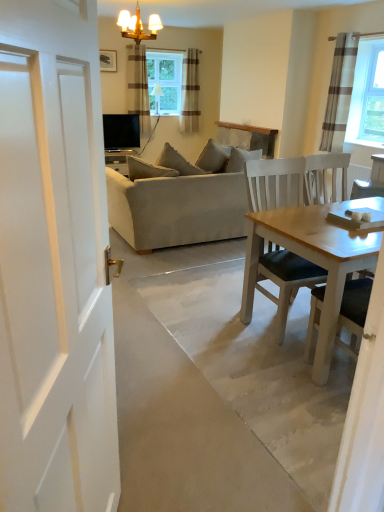
Question: Looking at their shapes, would you say gray striped curtain at upper right, which appears as the 3th curtain when viewed from the left, is wider or thinner than clear glass window at upper center?

Choices:
 (A) thin
 (B) wide

Answer: (B)

Question: Considering the positions of gray striped curtain at upper right, acting as the third curtain starting from the back, and clear glass window at upper center in the image, is gray striped curtain at upper right, acting as the third curtain starting from the back, taller or shorter than clear glass window at upper center?

Choices:
 (A) tall
 (B) short

Answer: (A)

Question: Which object is positioned closest to the beige striped curtain at upper center, arranged as the second curtain when viewed from the left?

Choices:
 (A) gray striped curtain at upper right, which appears as the 3th curtain when viewed from the left
 (B) beige fabric couch at center
 (C) clear glass window at upper center
 (D) wooden table at right
 (E) sheer brown striped curtain at upper center, placed as the second curtain when sorted from back to front

Answer: (C)

Question: Estimate the real-world distances between objects in this image. Which object is closer to the beige striped curtain at upper center, arranged as the second curtain when viewed from the left?

Choices:
 (A) beige fabric couch at center
 (B) gray striped curtain at upper right, acting as the third curtain starting from the back
 (C) clear glass window at upper center
 (D) gold metallic chandelier at upper center
 (E) sheer brown striped curtain at upper center, placed as the second curtain when sorted from back to front

Answer: (C)